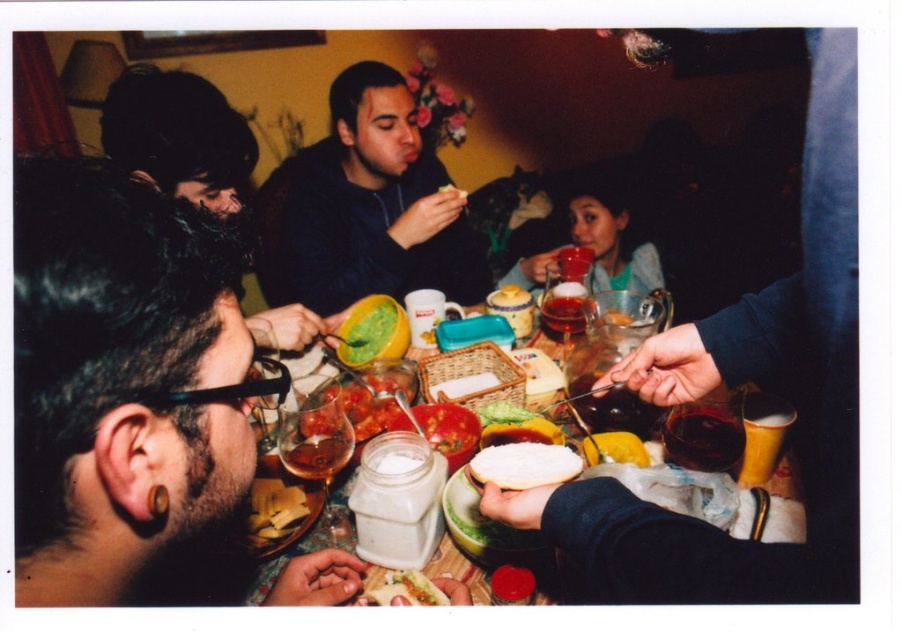
Looking at this image, can you confirm if white matte plate at center is smaller than yellow matte lemon at center?

No, white matte plate at center is not smaller than yellow matte lemon at center.

Does white matte plate at center lie behind yellow matte lemon at center?

That is False.

Locate an element on the screen. The height and width of the screenshot is (640, 902). white matte plate at center is located at coordinates (566, 582).

Locate an element on the screen. This screenshot has height=640, width=902. white matte plate at center is located at coordinates (566, 582).

Between dark brown hair at left and green matte guacamole at center, which one appears on the left side from the viewer's perspective?

dark brown hair at left

Is point (137, 132) behind point (451, 196)?

No, (137, 132) is closer to viewer.

Does point (203, 140) lie in front of point (459, 198)?

Yes.

Locate an element on the screen. dark brown hair at left is located at coordinates (179, 136).

Between point (601, 403) and point (325, 468), which one is positioned behind?

The point (601, 403) is behind.

Does yellow plastic cup at lower right have a lesser width compared to translucent glass wine at center?

No.

I want to click on yellow plastic cup at lower right, so click(x=612, y=408).

Identify the location of yellow plastic cup at lower right. The width and height of the screenshot is (902, 640). (612, 408).